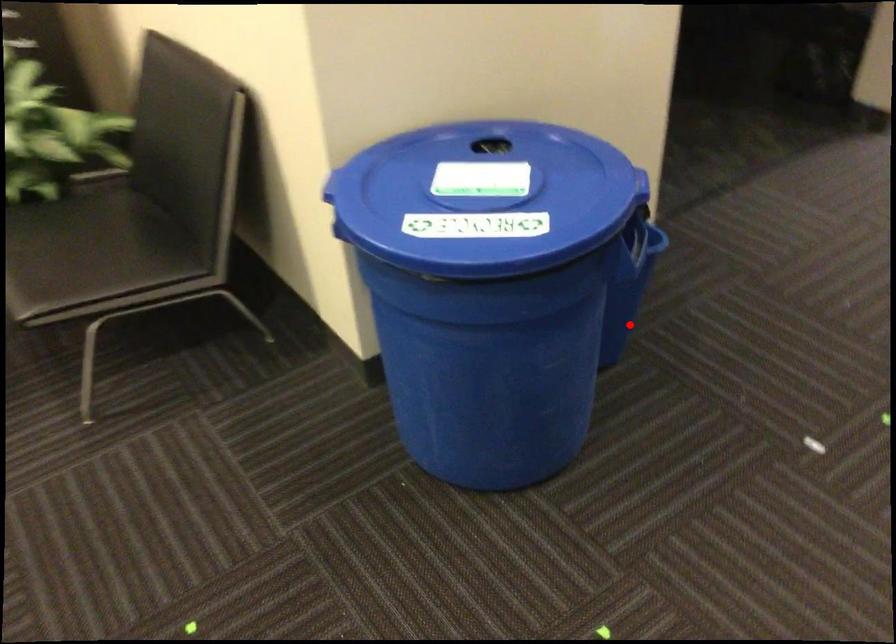
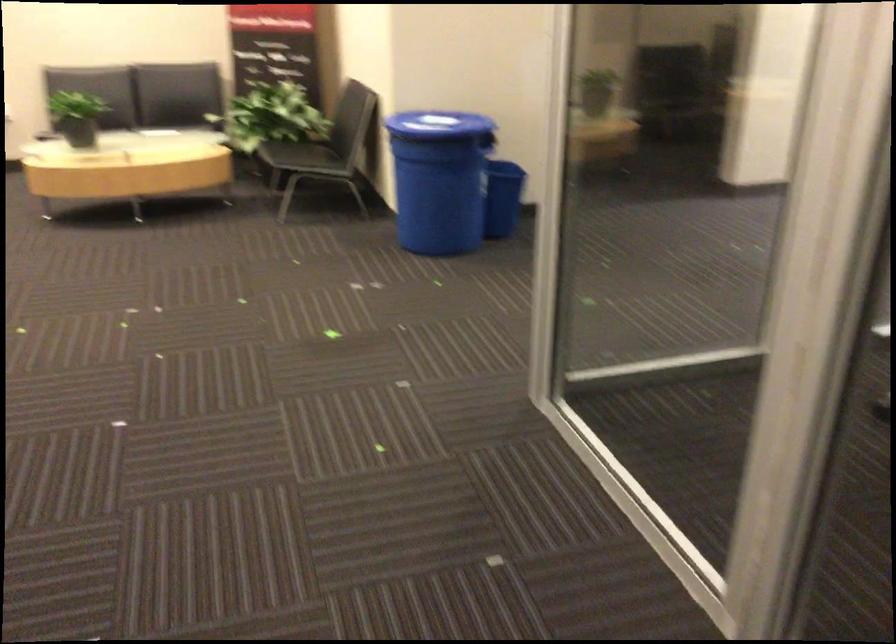
Question: A red point is marked in image1. In image2, is the corresponding 3D point closer to the camera or farther? Reply with the corresponding letter.

Choices:
 (A) The corresponding 3D point is closer.
 (B) The corresponding 3D point is farther.

Answer: (B)